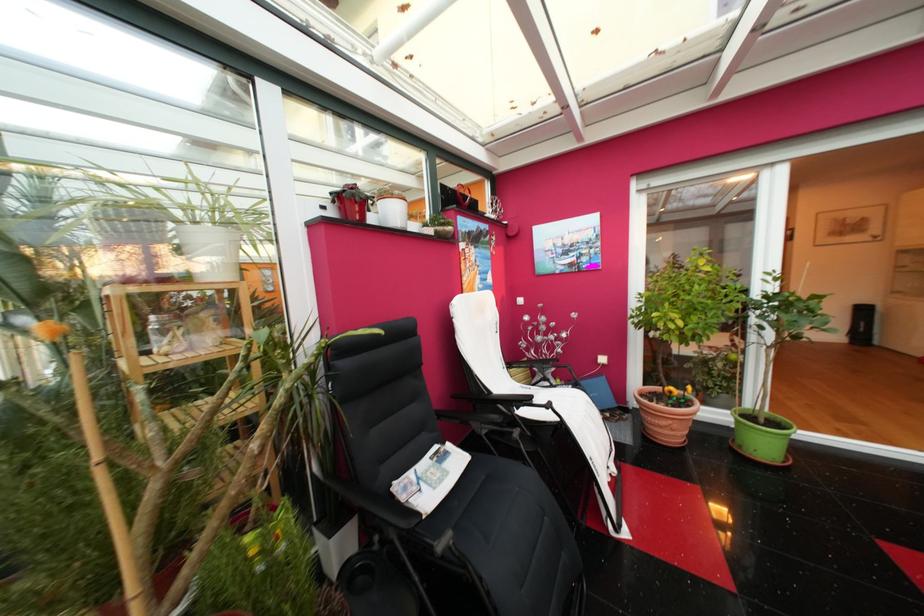
Where is `blue folder`? blue folder is located at coordinates (599, 391).